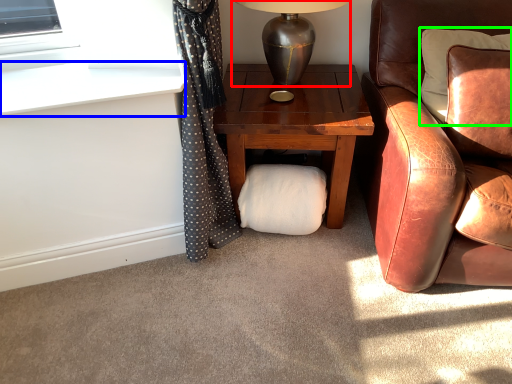
Question: Based on their relative distances, which object is nearer to table lamp (highlighted by a red box)? Choose from window sill (highlighted by a blue box) and pillow (highlighted by a green box).

Choices:
 (A) window sill
 (B) pillow

Answer: (B)